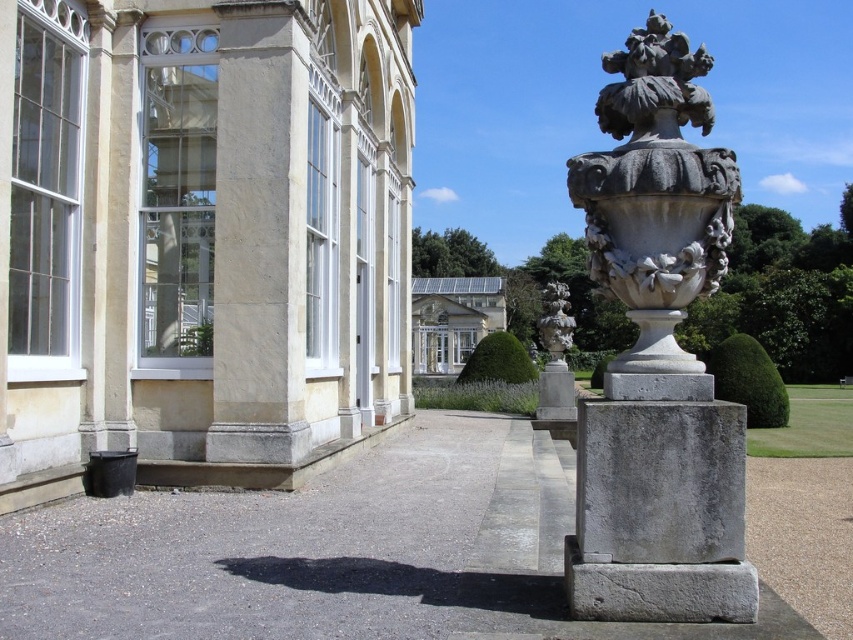
Which of these two, white stone vase at center or white stone palace at center, stands taller?

white stone palace at center is taller.

Where is `white stone vase at center`? This screenshot has width=853, height=640. white stone vase at center is located at coordinates (654, 209).

Is beige stone building at center wider than gray stone vase at center?

No.

Is beige stone building at center positioned behind gray stone vase at center?

No.

Who is more forward, [129,106] or [543,330]?

Positioned in front is point [129,106].

This screenshot has width=853, height=640. In order to click on beige stone building at center in this screenshot , I will do `click(202, 237)`.

Does white stone vase at center appear over gray stone vase at center?

Yes, white stone vase at center is above gray stone vase at center.

Looking at this image, who is more distant from viewer, (634, 180) or (538, 333)?

Point (538, 333)

Based on the photo, who is more forward, (611, 211) or (572, 320)?

Positioned in front is point (611, 211).

At what (x,y) coordinates should I click in order to perform the action: click on white stone vase at center. Please return your answer as a coordinate pair (x, y). This screenshot has width=853, height=640. Looking at the image, I should click on (654, 209).